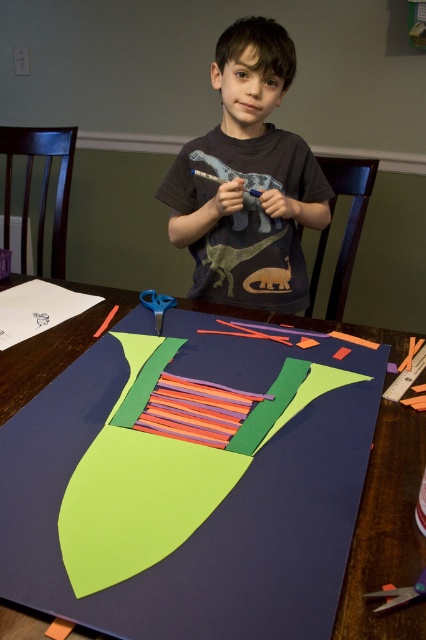
You are the boy in the scene. You want to place a sticker on the table between the two points, point (411, 576) and point (158, 324). Which point should you place the sticker closer to so that it is closer to the front of the table?

You should place the sticker closer to point (411, 576) because it is in front of point (158, 324).